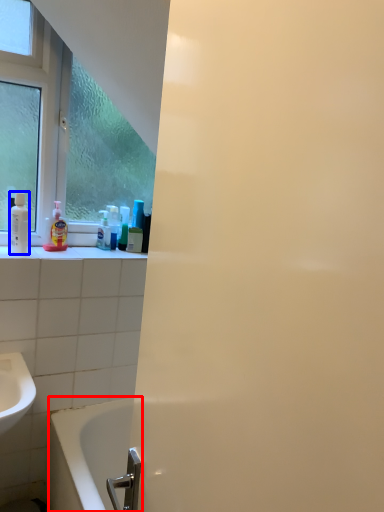
Question: Which point is further to the camera, bathtub (highlighted by a red box) or mouthwash (highlighted by a blue box)?

Choices:
 (A) bathtub
 (B) mouthwash

Answer: (B)